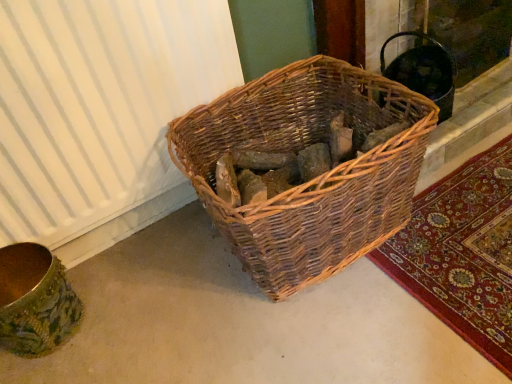
Image resolution: width=512 pixels, height=384 pixels. What do you see at coordinates (313, 179) in the screenshot? I see `woven brown basket at center` at bounding box center [313, 179].

Find the location of `woven brown basket at center`. woven brown basket at center is located at coordinates (313, 179).

Find the location of a particular element. woven brown basket at center is located at coordinates (313, 179).